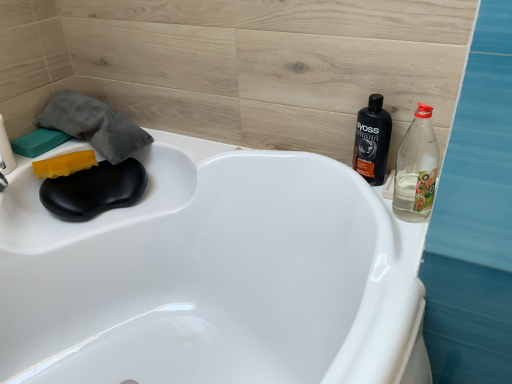
Question: Is yellow sponge at left, acting as the 2th soap starting from the left, taller or shorter than clear plastic bottle at right, the 2th bottle when ordered from back to front?

Choices:
 (A) short
 (B) tall

Answer: (A)

Question: In the image, is yellow sponge at left, acting as the first soap starting from the right, on the left side or the right side of clear plastic bottle at right, the 2th bottle when ordered from back to front?

Choices:
 (A) left
 (B) right

Answer: (A)

Question: Which object is the closest to the clear plastic bottle at right, the 2th bottle when ordered from back to front?

Choices:
 (A) black plastic bottle at upper right, the 1th bottle when ordered from back to front
 (B) green sponge at upper left, the first soap positioned from the left
 (C) yellow sponge at left, acting as the first soap starting from the right

Answer: (A)

Question: Which object is positioned farthest from the black plastic bottle at upper right, which is counted as the 2th bottle, starting from the front?

Choices:
 (A) clear plastic bottle at right, the 2th bottle when ordered from back to front
 (B) green sponge at upper left, the first soap positioned from the left
 (C) yellow sponge at left, acting as the 2th soap starting from the left

Answer: (B)